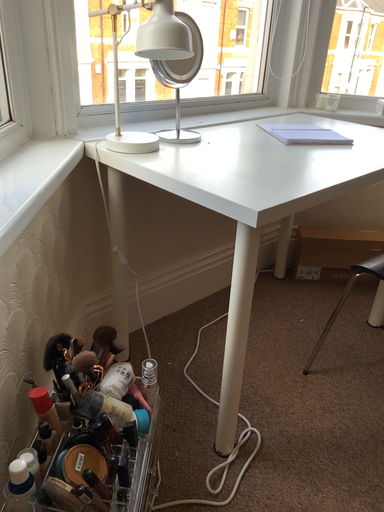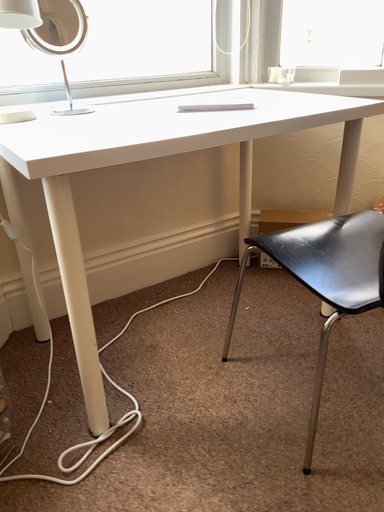
Question: Which way did the camera rotate in the video?

Choices:
 (A) rotated right
 (B) rotated left

Answer: (B)